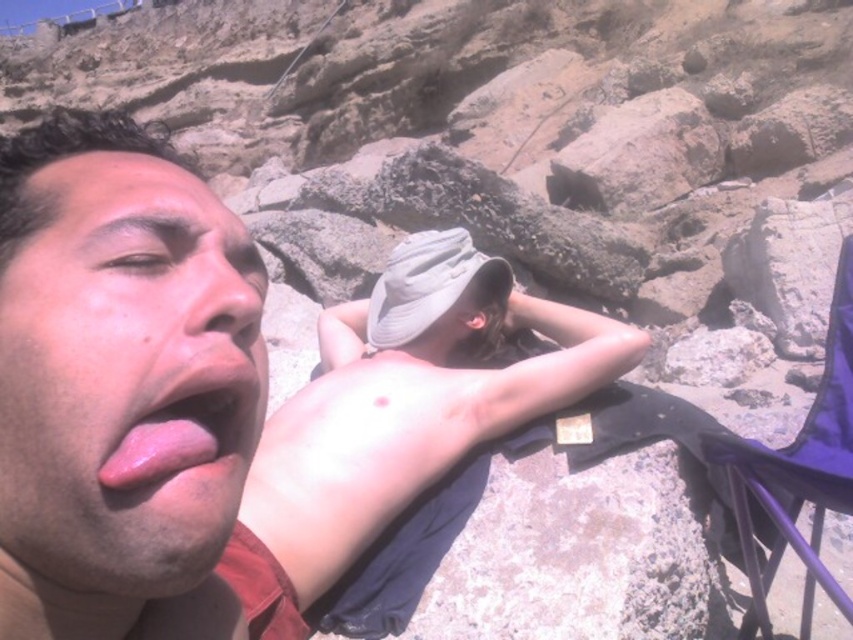
Question: Which object is closer to the camera taking this photo?

Choices:
 (A) pink glossy lips at center
 (B) smooth tan skin at center
 (C) smooth skin face at left
 (D) purple fabric chair at lower right

Answer: (A)

Question: Which of the following is the farthest from the observer?

Choices:
 (A) (80, 288)
 (B) (142, 448)
 (C) (405, 252)
 (D) (415, 435)

Answer: (C)

Question: Is pink glossy lips at center smaller than white fabric baseball hat at center?

Choices:
 (A) no
 (B) yes

Answer: (B)

Question: Can you confirm if smooth tan skin at center is positioned to the left of white fabric baseball hat at center?

Choices:
 (A) yes
 (B) no

Answer: (A)

Question: Is smooth tan skin at center above purple fabric chair at lower right?

Choices:
 (A) no
 (B) yes

Answer: (A)

Question: Which object appears closest to the camera in this image?

Choices:
 (A) smooth skin face at left
 (B) pink glossy lips at center

Answer: (B)